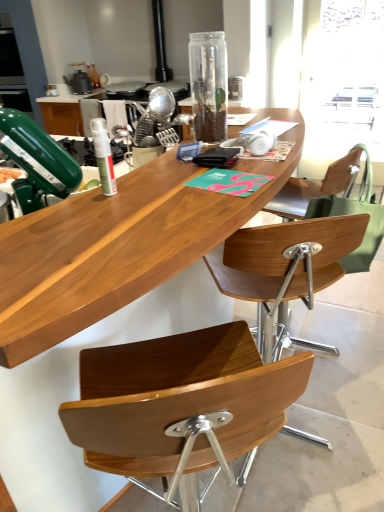
This screenshot has width=384, height=512. I want to click on empty space that is to the right of white matte spray can at center, which ranks as the second bottle in back-to-front order, so click(163, 192).